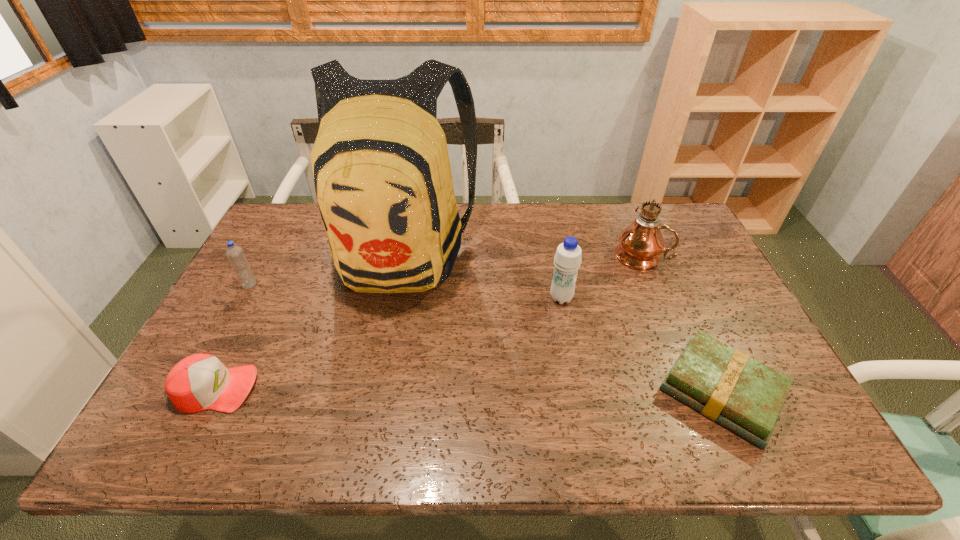
The height and width of the screenshot is (540, 960). I want to click on oil lamp at the right edge, so click(640, 244).

Where is `book that is at the right edge`? Image resolution: width=960 pixels, height=540 pixels. book that is at the right edge is located at coordinates (725, 385).

Find the location of a particular element. The image size is (960, 540). object located in the far right corner section of the desktop is located at coordinates (640, 244).

This screenshot has height=540, width=960. Find the location of `object at the near right corner`. object at the near right corner is located at coordinates (725, 385).

Locate an element on the screen. free point at the far edge is located at coordinates (632, 218).

Identify the location of free space at the near edge of the desktop. (621, 424).

Locate an element on the screen. vacant area at the right edge is located at coordinates pyautogui.click(x=689, y=251).

You are a GUI agent. You are given a task and a screenshot of the screen. Output one action in this format:
    pyautogui.click(x=<x>, y=<y>)
    Task: Click on the free space at the far left corner of the desktop
    This screenshot has width=960, height=540.
    Given the screenshot: What is the action you would take?
    pyautogui.click(x=313, y=205)

You are a GUI agent. You are given a task and a screenshot of the screen. Output one action in this format:
    pyautogui.click(x=<x>, y=<y>)
    Task: Click on the vacant space at the far right corner of the desktop
    
    Given the screenshot: What is the action you would take?
    pyautogui.click(x=673, y=226)

Where is `free space between the left water bottle and the backpack`? The height and width of the screenshot is (540, 960). free space between the left water bottle and the backpack is located at coordinates (325, 269).